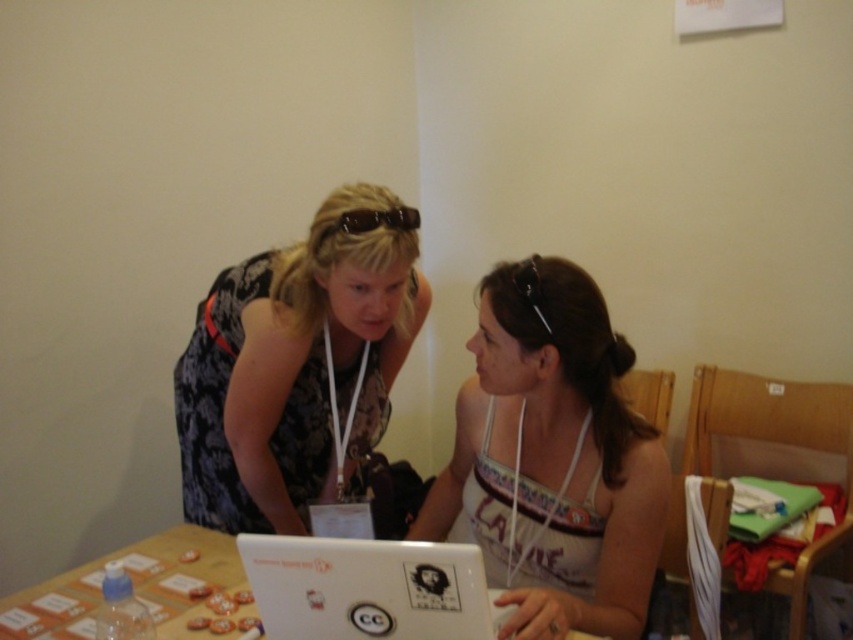
Question: Can you confirm if white fabric tank top at center is positioned to the right of white plastic table at center?

Choices:
 (A) yes
 (B) no

Answer: (A)

Question: Among these objects, which one is farthest from the camera?

Choices:
 (A) white fabric tank top at center
 (B) floral dress at center
 (C) brown matte goggles at upper center

Answer: (C)

Question: Does white fabric tank top at center have a smaller size compared to brown matte goggles at upper center?

Choices:
 (A) no
 (B) yes

Answer: (A)

Question: Can you confirm if floral dress at center is positioned to the left of white plastic table at center?

Choices:
 (A) no
 (B) yes

Answer: (A)

Question: Which point is closer to the camera?

Choices:
 (A) (650, 518)
 (B) (280, 598)
 (C) (146, 573)

Answer: (B)

Question: Which object appears closest to the camera in this image?

Choices:
 (A) white fabric tank top at center
 (B) floral dress at center
 (C) brown matte goggles at upper center

Answer: (A)